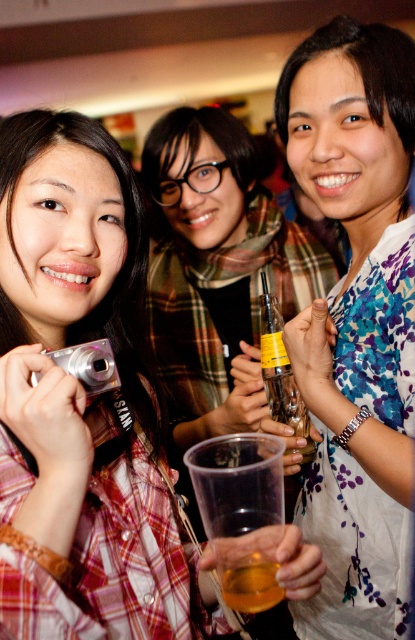
Question: Estimate the real-world distances between objects in this image. Which object is farther from the translucent plastic cup at center?

Choices:
 (A) floral fabric blouse at right
 (B) silver metallic camera at lower left
 (C) clear plastic bottle at center

Answer: (C)

Question: Which of the following is the closest to the observer?

Choices:
 (A) matte black camera at left
 (B) floral fabric blouse at right
 (C) silver metallic camera at lower left
 (D) clear plastic bottle at center

Answer: (A)

Question: From the image, what is the correct spatial relationship of clear plastic bottle at center in relation to translucent plastic cup at center?

Choices:
 (A) above
 (B) below

Answer: (A)

Question: Considering the relative positions of floral fabric blouse at right and clear plastic bottle at center in the image provided, where is floral fabric blouse at right located with respect to clear plastic bottle at center?

Choices:
 (A) right
 (B) left

Answer: (A)

Question: Considering the real-world distances, which object is farthest from the floral fabric blouse at right?

Choices:
 (A) matte black camera at left
 (B) silver metallic camera at lower left
 (C) clear plastic bottle at center

Answer: (B)

Question: Does matte black camera at left appear on the right side of translucent plastic cup at center?

Choices:
 (A) no
 (B) yes

Answer: (A)